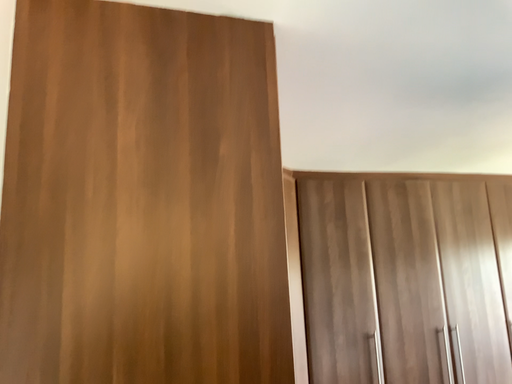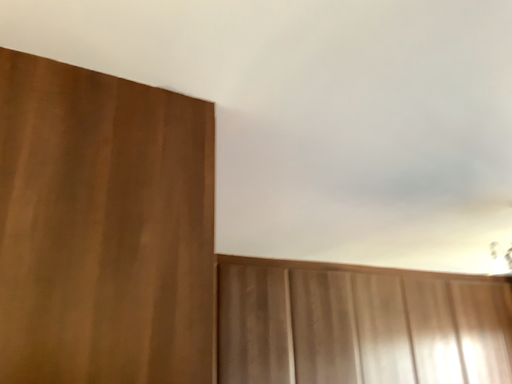
Question: How did the camera likely rotate when shooting the video?

Choices:
 (A) rotated left
 (B) rotated right

Answer: (B)